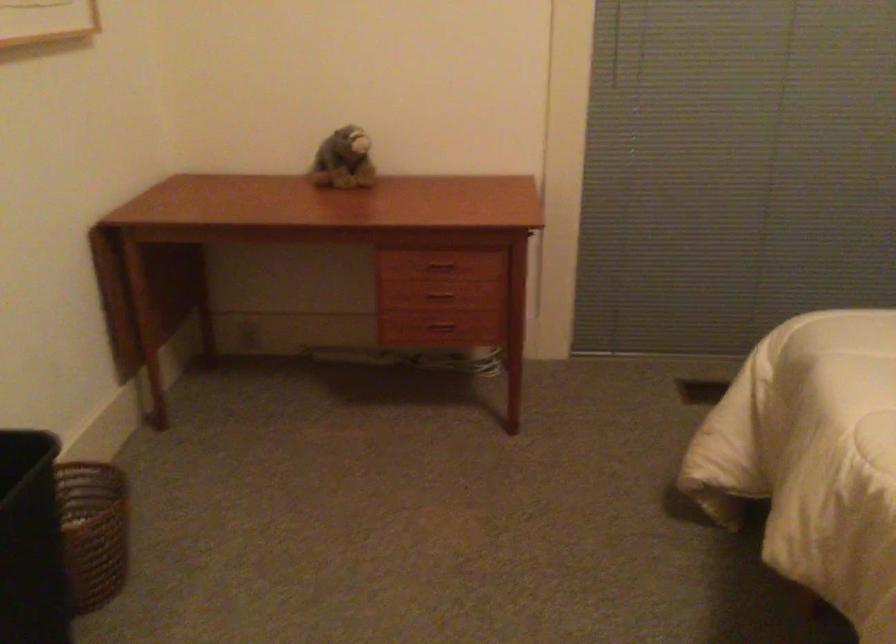
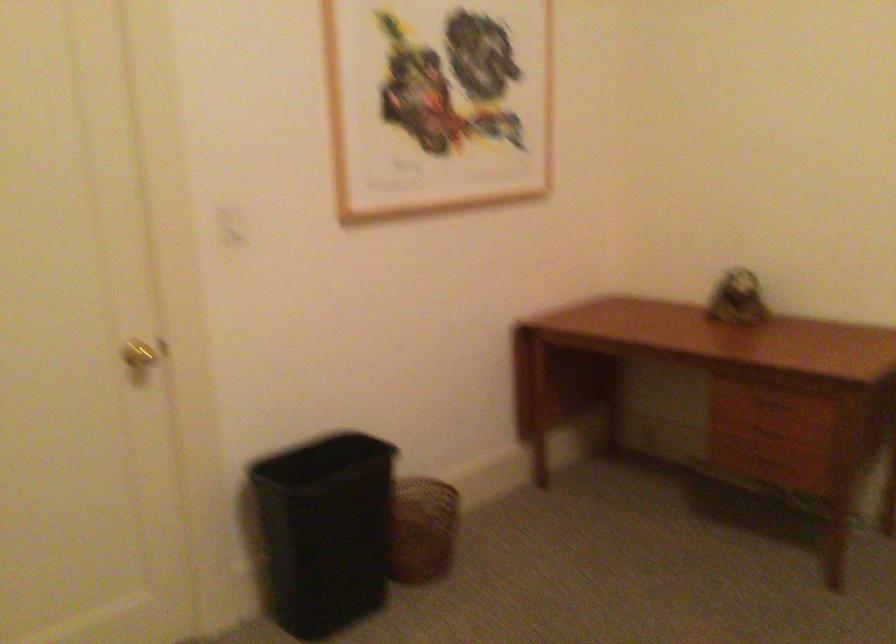
Find the pixel in the second image that matches pixel 110 529 in the first image.

(423, 529)